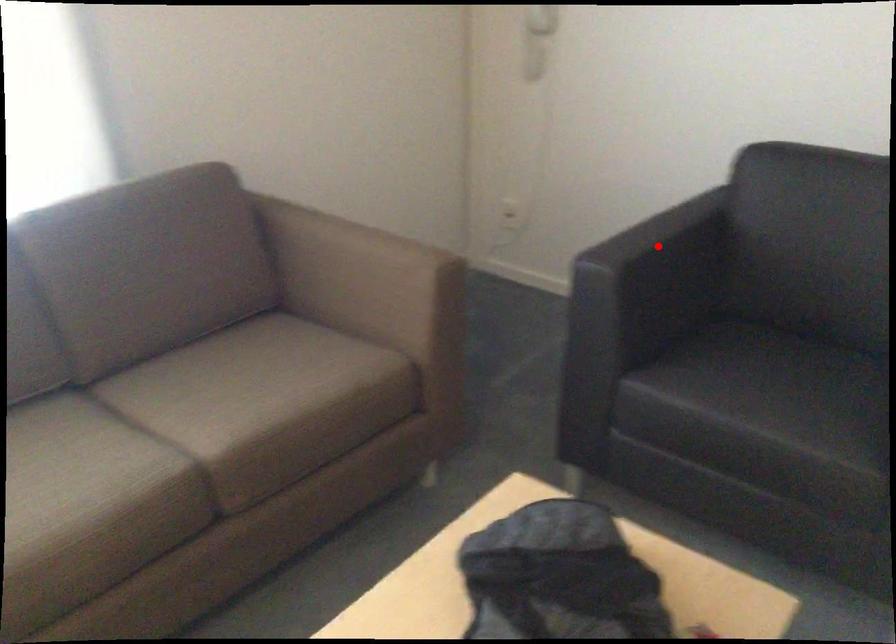
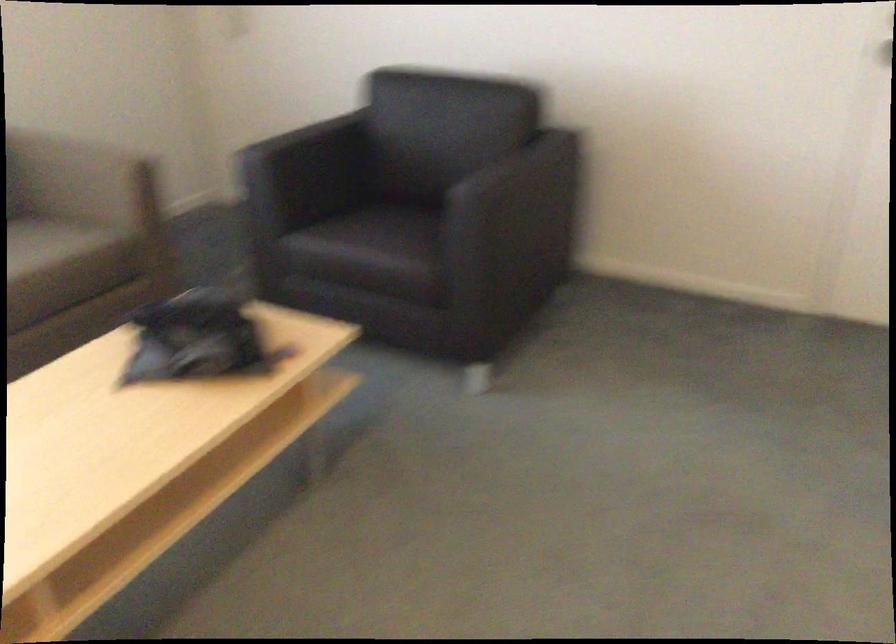
Question: I am providing you with two images of the same scene from different viewpoints. A red point is shown in image1. For the corresponding object point in image2, is it positioned nearer or farther from the camera?

Choices:
 (A) Nearer
 (B) Farther

Answer: (B)